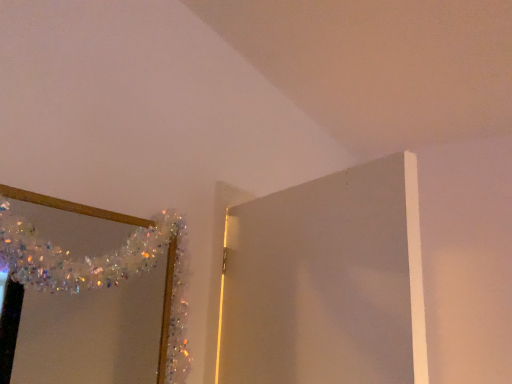
This screenshot has height=384, width=512. What do you see at coordinates (92, 334) in the screenshot? I see `iridescent glass mirror at upper left` at bounding box center [92, 334].

Where is `iridescent glass mirror at upper left`? This screenshot has width=512, height=384. iridescent glass mirror at upper left is located at coordinates (92, 334).

What are the coordinates of `iridescent glass mirror at upper left` in the screenshot? It's located at (92, 334).